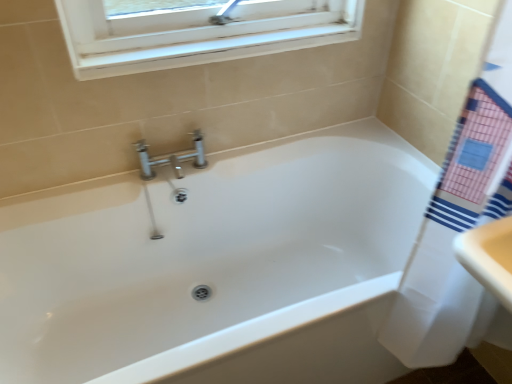
Question: Can you confirm if white fabric towel at right is bigger than white glossy bathtub at center?

Choices:
 (A) no
 (B) yes

Answer: (A)

Question: Is white glossy bathtub at center surrounded by white fabric towel at right?

Choices:
 (A) yes
 (B) no

Answer: (B)

Question: From a real-world perspective, does white fabric towel at right stand above white glossy bathtub at center?

Choices:
 (A) no
 (B) yes

Answer: (B)

Question: Is white fabric towel at right placed right next to white glossy bathtub at center?

Choices:
 (A) no
 (B) yes

Answer: (A)

Question: Does white fabric towel at right have a lesser height compared to white glossy bathtub at center?

Choices:
 (A) yes
 (B) no

Answer: (B)

Question: Does white fabric towel at right have a greater height compared to white glossy bathtub at center?

Choices:
 (A) yes
 (B) no

Answer: (A)

Question: Does white glossy bathtub at center have a smaller size compared to white fabric towel at right?

Choices:
 (A) no
 (B) yes

Answer: (A)

Question: Considering the relative positions of white glossy bathtub at center and white fabric towel at right in the image provided, is white glossy bathtub at center behind white fabric towel at right?

Choices:
 (A) no
 (B) yes

Answer: (B)

Question: From the image's perspective, would you say white glossy bathtub at center is shown under white fabric towel at right?

Choices:
 (A) no
 (B) yes

Answer: (A)

Question: Could you tell me if white glossy bathtub at center is turned towards white fabric towel at right?

Choices:
 (A) yes
 (B) no

Answer: (A)

Question: From a real-world perspective, is white glossy bathtub at center positioned over white fabric towel at right based on gravity?

Choices:
 (A) no
 (B) yes

Answer: (A)

Question: Is white glossy bathtub at center positioned with its back to white fabric towel at right?

Choices:
 (A) yes
 (B) no

Answer: (B)

Question: From the image's perspective, relative to white fabric towel at right, is white glossy bathtub at center above or below?

Choices:
 (A) above
 (B) below

Answer: (A)